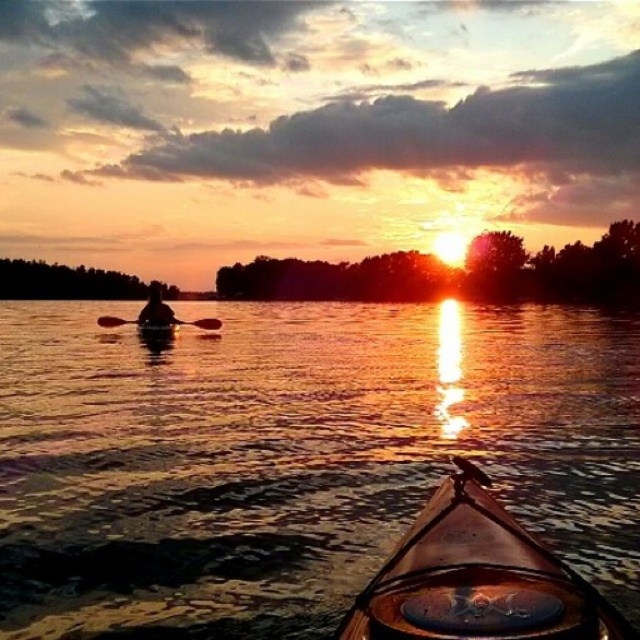
Question: Can you confirm if wooden canoe at center is bigger than black wood paddle at center?

Choices:
 (A) yes
 (B) no

Answer: (B)

Question: Which object is farther from the camera taking this photo?

Choices:
 (A) silhouette wood person at center
 (B) transparent plastic kayak at center

Answer: (A)

Question: Which object is the farthest from the black wood paddle at center?

Choices:
 (A) smooth brown canoe at center
 (B) transparent plastic kayak at center
 (C) silhouette wood person at center
 (D) wooden canoe at center

Answer: (D)

Question: Is the position of wooden canoe at center less distant than that of black wood paddle at center?

Choices:
 (A) yes
 (B) no

Answer: (A)

Question: Is transparent plastic kayak at center to the left of wooden canoe at center from the viewer's perspective?

Choices:
 (A) no
 (B) yes

Answer: (B)

Question: Which is farther from the transparent plastic kayak at center?

Choices:
 (A) smooth brown canoe at center
 (B) wooden canoe at center
 (C) silhouette wood person at center

Answer: (C)